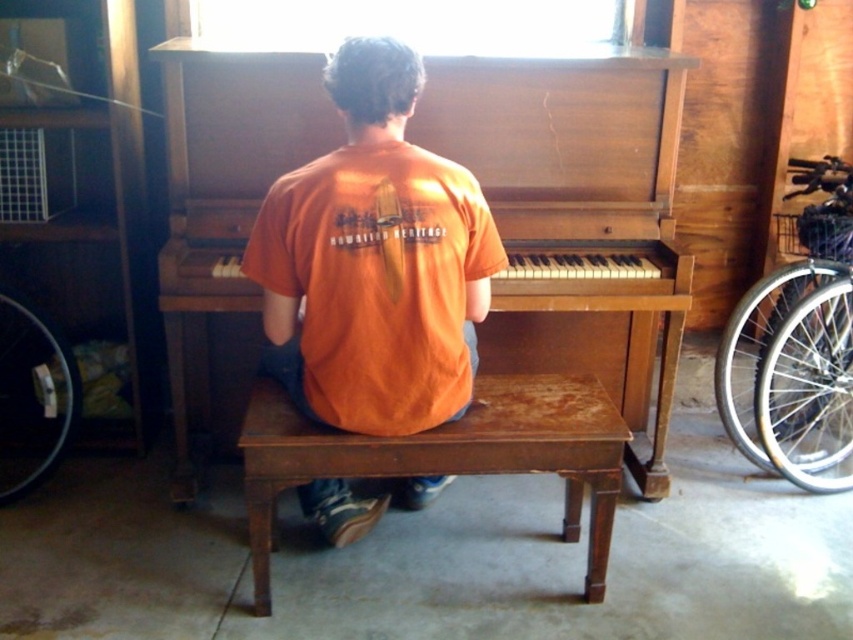
Question: Which object is the closest to the orange matte shirt at center?

Choices:
 (A) dark brown wooden stool at center
 (B) wooden piano at center

Answer: (A)

Question: Is orange matte shirt at center bigger than dark brown wooden stool at center?

Choices:
 (A) yes
 (B) no

Answer: (B)

Question: Which object is farther from the camera taking this photo?

Choices:
 (A) dark brown wooden stool at center
 (B) wooden piano at center
 (C) orange matte shirt at center

Answer: (B)

Question: Among these points, which one is farthest from the camera?

Choices:
 (A) (334, 275)
 (B) (618, 460)

Answer: (B)

Question: Is orange matte shirt at center thinner than dark brown wooden stool at center?

Choices:
 (A) yes
 (B) no

Answer: (A)

Question: Where is wooden piano at center located in relation to dark brown wooden stool at center in the image?

Choices:
 (A) left
 (B) right

Answer: (A)